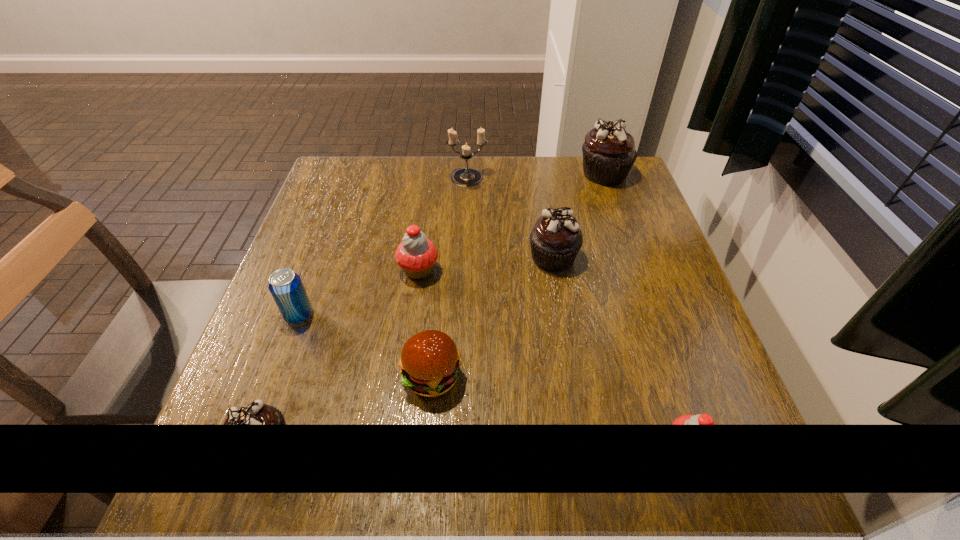
This screenshot has height=540, width=960. In order to click on vacant space located 0.060m on the front of the brown hamburger in this screenshot , I will do `click(426, 439)`.

Where is `vacant space located on the back of the right red cupcake`? vacant space located on the back of the right red cupcake is located at coordinates (655, 349).

The image size is (960, 540). In order to click on free region located 0.370m on the right of the leftmost brown cupcake in this screenshot , I will do `click(525, 443)`.

Identify the location of cupcake that is positioned at the far edge. (609, 153).

Where is `candle holder at the far edge`? The height and width of the screenshot is (540, 960). candle holder at the far edge is located at coordinates (465, 177).

At what (x,y) coordinates should I click in order to perform the action: click on beer can at the left edge. Please return your answer as a coordinate pair (x, y). Looking at the image, I should click on (285, 286).

What are the coordinates of `cupcake at the left edge` in the screenshot? It's located at (256, 413).

The image size is (960, 540). I want to click on object that is at the near left corner, so click(256, 413).

Image resolution: width=960 pixels, height=540 pixels. I want to click on object that is at the far right corner, so 609,153.

Find the location of a particular element. The width and height of the screenshot is (960, 540). object located at the near right corner is located at coordinates (701, 419).